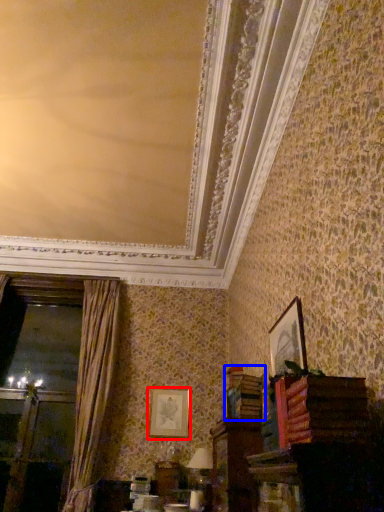
Question: Among these objects, which one is farthest to the camera, picture frame (highlighted by a red box) or book (highlighted by a blue box)?

Choices:
 (A) picture frame
 (B) book

Answer: (A)